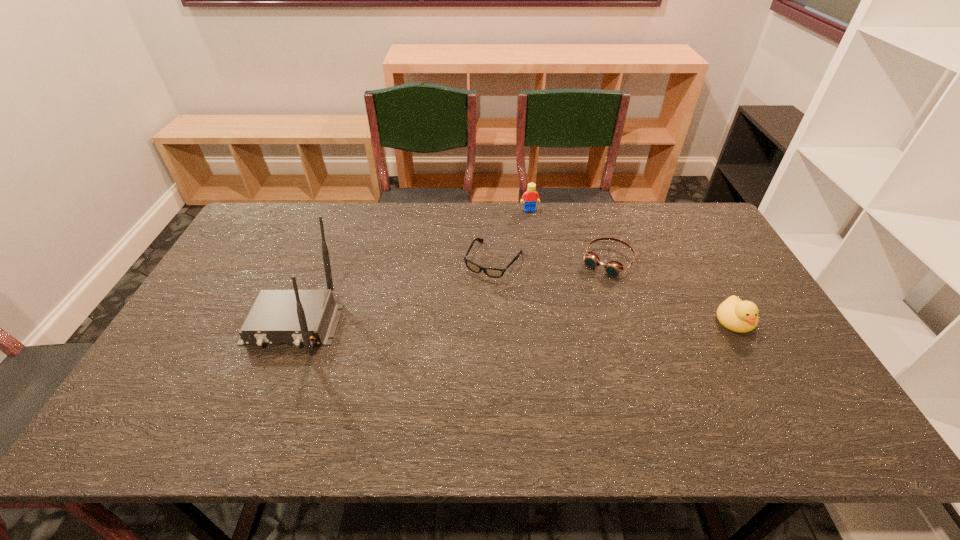
This screenshot has height=540, width=960. Find the location of `blank space located on the front-facing side of the spectacles`. blank space located on the front-facing side of the spectacles is located at coordinates (433, 359).

Where is `vacant area situated on the front-facing side of the spectacles`? The image size is (960, 540). vacant area situated on the front-facing side of the spectacles is located at coordinates (448, 334).

You are a GUI agent. You are given a task and a screenshot of the screen. Output one action in this format:
    pyautogui.click(x=<x>, y=<y>)
    Task: Click on the free region located on the front-facing side of the spectacles
    The height and width of the screenshot is (540, 960).
    Given the screenshot: What is the action you would take?
    pyautogui.click(x=421, y=377)

The width and height of the screenshot is (960, 540). I want to click on vacant area located on the face of the farthest object, so click(546, 274).

Image resolution: width=960 pixels, height=540 pixels. Identify the location of vacant space positioned on the face of the farthest object. (536, 231).

Locate an element on the screen. This screenshot has height=540, width=960. free region located on the face of the farthest object is located at coordinates pyautogui.click(x=545, y=270).

I want to click on vacant space positioned 0.380m through the lenses of the fourth object from left to right, so click(540, 362).

Locate an element on the screen. Image resolution: width=960 pixels, height=540 pixels. vacant position located 0.370m through the lenses of the fourth object from left to right is located at coordinates (541, 360).

Image resolution: width=960 pixels, height=540 pixels. In order to click on free region located through the lenses of the fourth object from left to right in this screenshot , I will do `click(543, 357)`.

The width and height of the screenshot is (960, 540). What are the coordinates of `spectacles that is at the far edge` in the screenshot? It's located at pos(490,272).